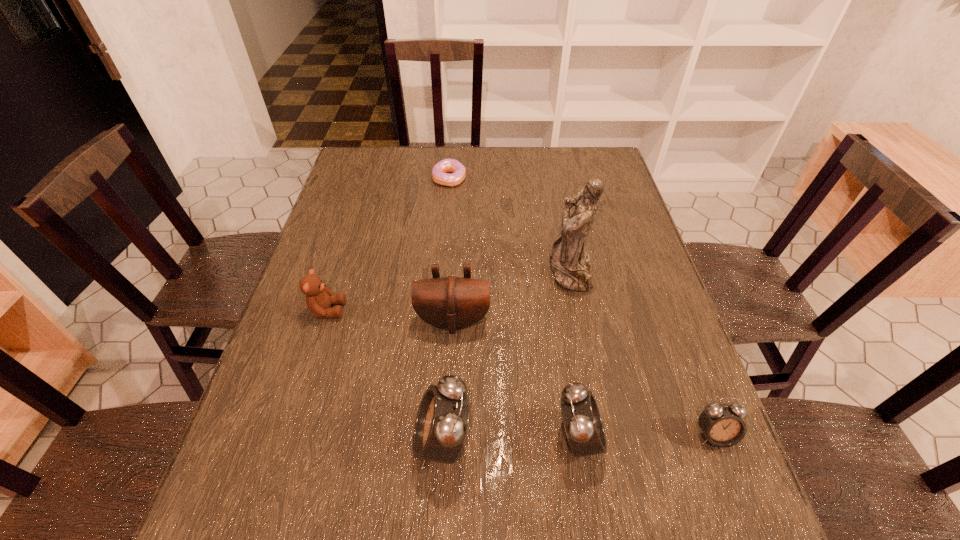
Find the location of `the leftmost alarm clock`. the leftmost alarm clock is located at coordinates (441, 424).

What are the coordinates of `the second tallest alarm clock` in the screenshot? It's located at (582, 421).

The image size is (960, 540). Find the location of `the shortest alarm clock`. the shortest alarm clock is located at coordinates (722, 425).

This screenshot has height=540, width=960. Identify the location of the sixth tallest object. (722, 425).

This screenshot has width=960, height=540. Find the location of `the shortest object`. the shortest object is located at coordinates (440, 173).

You are a GUI agent. You are given a task and a screenshot of the screen. Output one action in this format:
    pyautogui.click(x=<x>, y=<y>)
    Task: Click on the farthest object
    The height and width of the screenshot is (540, 960).
    Given the screenshot: What is the action you would take?
    pyautogui.click(x=440, y=173)

Where is `figurine`? figurine is located at coordinates (569, 262).

Locate an element on the screen. The image size is (960, 540). the tallest object is located at coordinates (569, 262).

Where is `pouch`? Image resolution: width=960 pixels, height=540 pixels. pouch is located at coordinates (451, 302).

Locate an element on the screen. The height and width of the screenshot is (540, 960). the leftmost object is located at coordinates (318, 298).